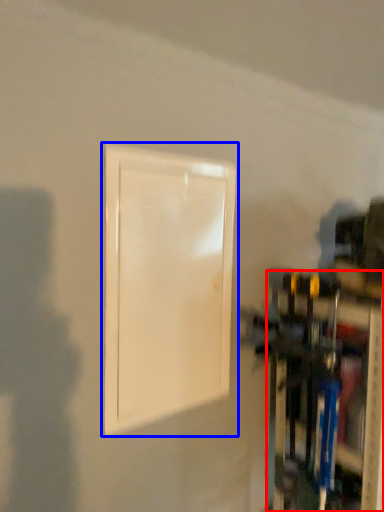
Question: Which object is closer to the camera taking this photo, shelf (highlighted by a red box) or door (highlighted by a blue box)?

Choices:
 (A) shelf
 (B) door

Answer: (B)